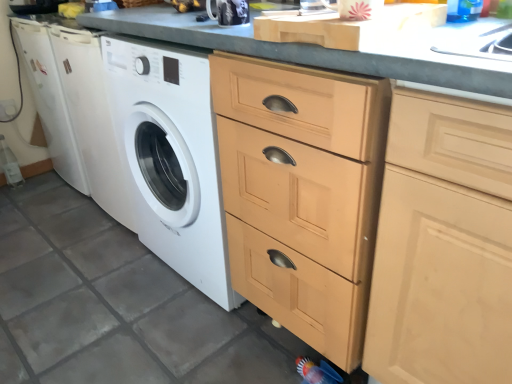
This screenshot has width=512, height=384. What do you see at coordinates (358, 229) in the screenshot?
I see `light wood cabinet at center` at bounding box center [358, 229].

The width and height of the screenshot is (512, 384). I want to click on light wood cabinet at center, so click(358, 229).

Where is `glossy ceramic mug at upper center`? The width and height of the screenshot is (512, 384). glossy ceramic mug at upper center is located at coordinates (229, 12).

What do you see at coordinates (229, 12) in the screenshot? This screenshot has width=512, height=384. I see `glossy ceramic mug at upper center` at bounding box center [229, 12].

What are the coordinates of `light wood cabinet at center` in the screenshot? It's located at (358, 229).

Considering the relative positions of light wood cabinet at center and glossy ceramic mug at upper center in the image provided, is light wood cabinet at center to the left or to the right of glossy ceramic mug at upper center?

In the image, light wood cabinet at center appears on the right side of glossy ceramic mug at upper center.

Is light wood cabinet at center positioned before glossy ceramic mug at upper center?

Yes, light wood cabinet at center is closer to the camera.

Between point (509, 175) and point (217, 15), which one is positioned in front?

The point (509, 175) is closer to the camera.

From the image's perspective, would you say light wood cabinet at center is shown under glossy ceramic mug at upper center?

Yes, from the image's perspective, light wood cabinet at center is beneath glossy ceramic mug at upper center.

From a real-world perspective, does light wood cabinet at center stand above glossy ceramic mug at upper center?

No, from a real-world perspective, light wood cabinet at center is not on top of glossy ceramic mug at upper center.

Can you confirm if light wood cabinet at center is wider than glossy ceramic mug at upper center?

Correct, the width of light wood cabinet at center exceeds that of glossy ceramic mug at upper center.

From their relative heights in the image, would you say light wood cabinet at center is taller or shorter than glossy ceramic mug at upper center?

Clearly, light wood cabinet at center is taller compared to glossy ceramic mug at upper center.

Does light wood cabinet at center have a larger size compared to glossy ceramic mug at upper center?

Indeed, light wood cabinet at center has a larger size compared to glossy ceramic mug at upper center.

Can glossy ceramic mug at upper center be found inside light wood cabinet at center?

No, glossy ceramic mug at upper center is not a part of light wood cabinet at center.

Are light wood cabinet at center and glossy ceramic mug at upper center making contact?

No, light wood cabinet at center is not next to glossy ceramic mug at upper center.

Could you tell me if light wood cabinet at center is turned towards glossy ceramic mug at upper center?

No, light wood cabinet at center is not facing towards glossy ceramic mug at upper center.

Find the location of `appliance on the left side of light wood cabinet at center`. appliance on the left side of light wood cabinet at center is located at coordinates (229, 12).

Which object is positioned more to the left, glossy ceramic mug at upper center or light wood cabinet at center?

glossy ceramic mug at upper center.

Is glossy ceramic mug at upper center further to the viewer compared to light wood cabinet at center?

Yes, glossy ceramic mug at upper center is further from the viewer.

Between point (218, 0) and point (236, 258), which one is positioned behind?

The point (236, 258) is farther from the camera.

Consider the image. From the image's perspective, which one is positioned lower, glossy ceramic mug at upper center or light wood cabinet at center?

light wood cabinet at center appears lower in the image.

From a real-world perspective, is glossy ceramic mug at upper center under light wood cabinet at center?

Actually, glossy ceramic mug at upper center is physically above light wood cabinet at center in the real world.

Between glossy ceramic mug at upper center and light wood cabinet at center, which one has smaller width?

glossy ceramic mug at upper center.

Considering the sizes of glossy ceramic mug at upper center and light wood cabinet at center in the image, is glossy ceramic mug at upper center taller or shorter than light wood cabinet at center?

Considering their sizes, glossy ceramic mug at upper center has less height than light wood cabinet at center.

Between glossy ceramic mug at upper center and light wood cabinet at center, which one has larger size?

With larger size is light wood cabinet at center.

Is glossy ceramic mug at upper center inside or outside of light wood cabinet at center?

glossy ceramic mug at upper center cannot be found inside light wood cabinet at center.

Is glossy ceramic mug at upper center with light wood cabinet at center?

There is a gap between glossy ceramic mug at upper center and light wood cabinet at center.

Is glossy ceramic mug at upper center looking in the opposite direction of light wood cabinet at center?

No, light wood cabinet at center is not at the back of glossy ceramic mug at upper center.

Where is `appliance on the left of the light wood cabinet at center`? appliance on the left of the light wood cabinet at center is located at coordinates (229, 12).

What are the coordinates of `appliance above the light wood cabinet at center (from a real-world perspective)` in the screenshot? It's located at (229, 12).

Locate an element on the screen. This screenshot has width=512, height=384. cabinetry on the right of glossy ceramic mug at upper center is located at coordinates (358, 229).